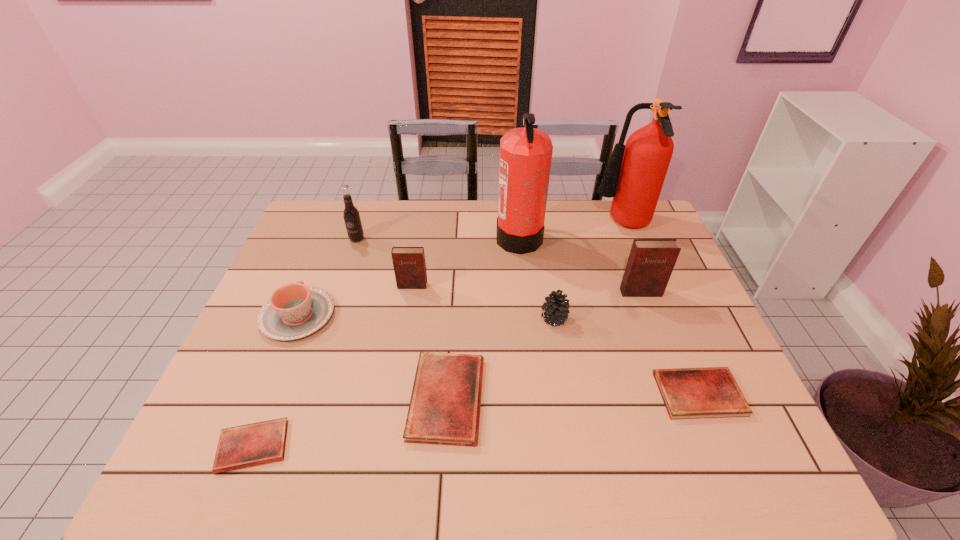
Identify the location of vacant space at the near edge. (362, 458).

In the image, there is a desktop. Where is `vacant space at the left edge`? This screenshot has width=960, height=540. vacant space at the left edge is located at coordinates (270, 388).

At what (x,y) coordinates should I click in order to perform the action: click on vacant area at the right edge. Please return your answer as a coordinate pair (x, y). The image size is (960, 540). Looking at the image, I should click on (679, 277).

Image resolution: width=960 pixels, height=540 pixels. I want to click on free space at the far left corner of the desktop, so click(325, 206).

Where is `free space at the far right corner of the desktop`? The image size is (960, 540). free space at the far right corner of the desktop is located at coordinates (635, 232).

I want to click on free space between the fifth shortest object and the second red diary from left to right, so click(500, 359).

Find the location of a particular element. This screenshot has height=540, width=960. vacant space that's between the pinecone and the second tallest diary is located at coordinates (483, 302).

Where is `vacant space that is in between the biggest red diary and the leftmost red diary`? This screenshot has height=540, width=960. vacant space that is in between the biggest red diary and the leftmost red diary is located at coordinates (350, 422).

At what (x,y) coordinates should I click in order to perform the action: click on vacant space in between the fifth tallest object and the brown pinecone. Please return your answer as a coordinate pair (x, y). Image resolution: width=960 pixels, height=540 pixels. Looking at the image, I should click on (483, 302).

Where is `vacant space in between the sixth shortest object and the second shortest diary`? This screenshot has height=540, width=960. vacant space in between the sixth shortest object and the second shortest diary is located at coordinates click(556, 340).